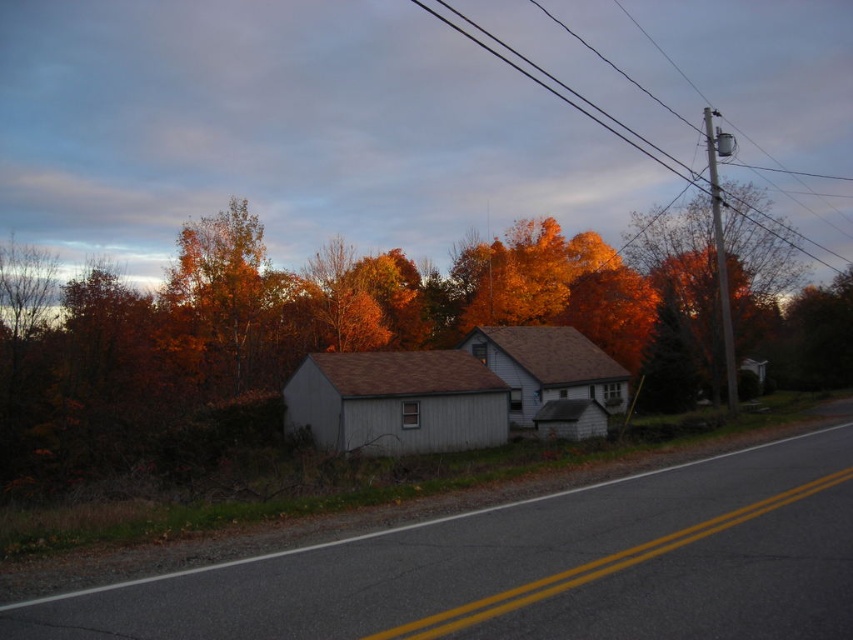
Consider the image. You are a pedestrian standing on the side of the road in the scene. You notice orange leaves at center and metallic wire at upper center. Which of these two objects is wider?

The orange leaves at center are wider than the metallic wire at upper center.

You are standing at the point with coordinates point (192, 321) and want to walk to the point with coordinates point (604, 109). Which direction should you move to get closer to your destination?

You should move towards the upper left direction because point (192, 321) is closer to the viewer than point (604, 109), so moving towards the upper left will take you in the direction of the destination.

You are driving a car on the road and notice orange leaves at center and metallic wire at upper center in your view. Which object is closer to your car?

The orange leaves at center are closer to your car because they are in front of the metallic wire at upper center.